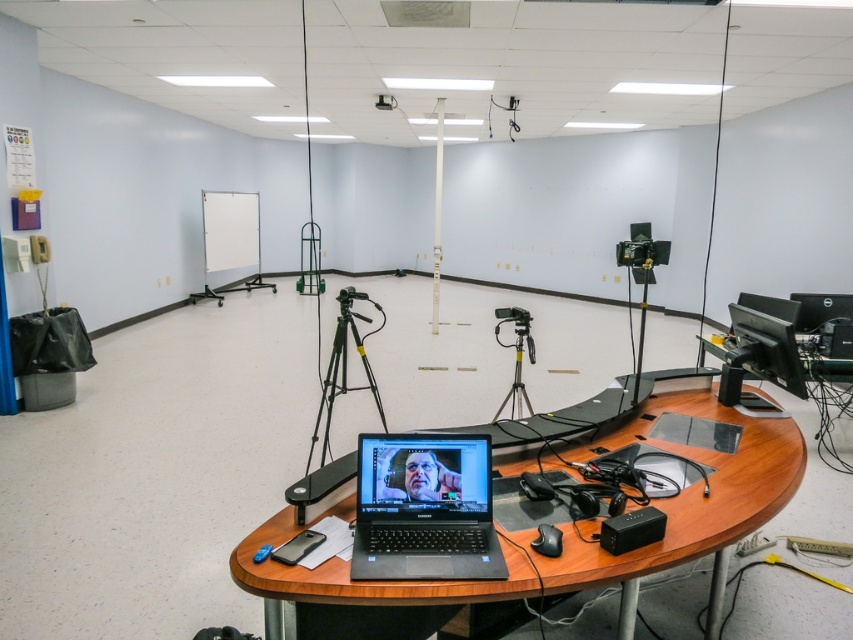
You are setting up a new webcam for a live stream. The webcam needs to be placed above the black matte laptop at center so it can capture your face. Is the wooden round table at center an obstacle for this setup?

The wooden round table at center is below the black matte laptop at center, so it will not block the placement of the webcam above the laptop. The setup should work as planned.

You are setting up equipment in this room and need to place a large camera on the silver metallic tripod at center and a small remote control next to the black plastic projector at upper center. Given their sizes, will the tripod and projector be able to accommodate their respective items?

The silver metallic tripod at center has a larger size compared to the black plastic projector at upper center. This means the tripod can easily hold the large camera, while the projector might have limited space for the small remote control next to it. However, since the remote is small, it should fit near the projector unless the area is cluttered.

You are setting up a camera for a live stream. The camera needs to be placed on the silver metallic tripod at center so it can face the wooden round table at center. Is the tripod positioned in a way that allows the camera to capture the entire table without obstruction?

The wooden round table at center is in front of the silver metallic tripod at center, so placing the camera on the tripod would position it behind the table, making it impossible to capture the table from that angle. The camera would instead be facing away from the table, resulting in an obstructed view.